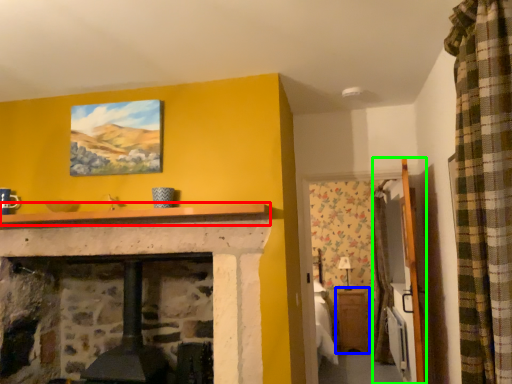
Question: Which is nearer to the mantle (highlighted by a red box)? table (highlighted by a blue box) or armoire (highlighted by a green box).

Choices:
 (A) table
 (B) armoire

Answer: (B)